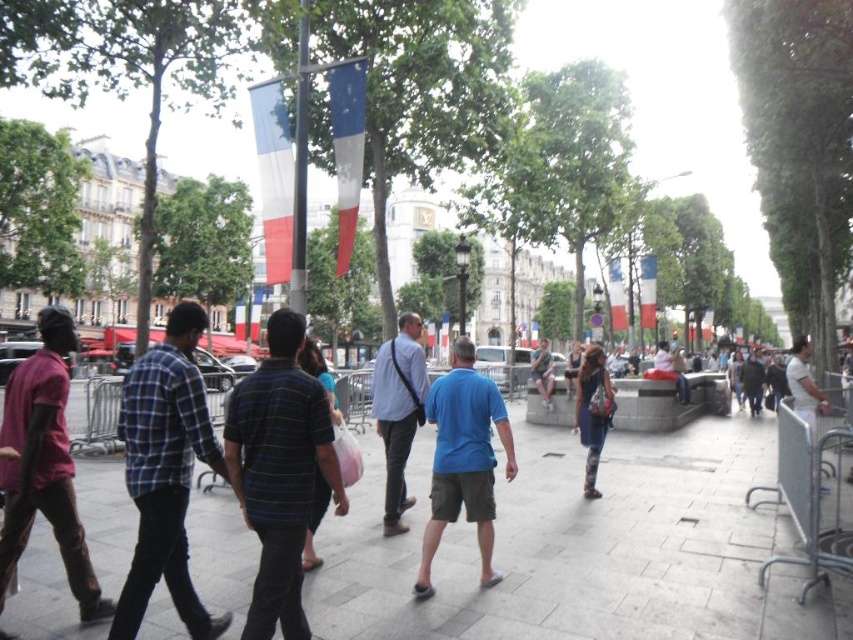
You are standing in the middle of the urban scene and want to determine which of the two points, point (392, 355) or point (599, 371), is nearer to you. Based on the scene description, which point is closer?

Point (392, 355) is closer to the viewer than point (599, 371).

In the scene described, where is the matte red shirt at left positioned in terms of its 2D coordinates?

The matte red shirt at left is positioned at the 2D coordinates of point (x=44, y=465).

You are a photographer standing in the middle of the plaza. You notice two people wearing a matte blue shirt at center and a denim skirt at center. Which person is standing more to your left?

The matte blue shirt at center is positioned on the left side of denim skirt at center, so the person wearing the matte blue shirt at center is more to the left.